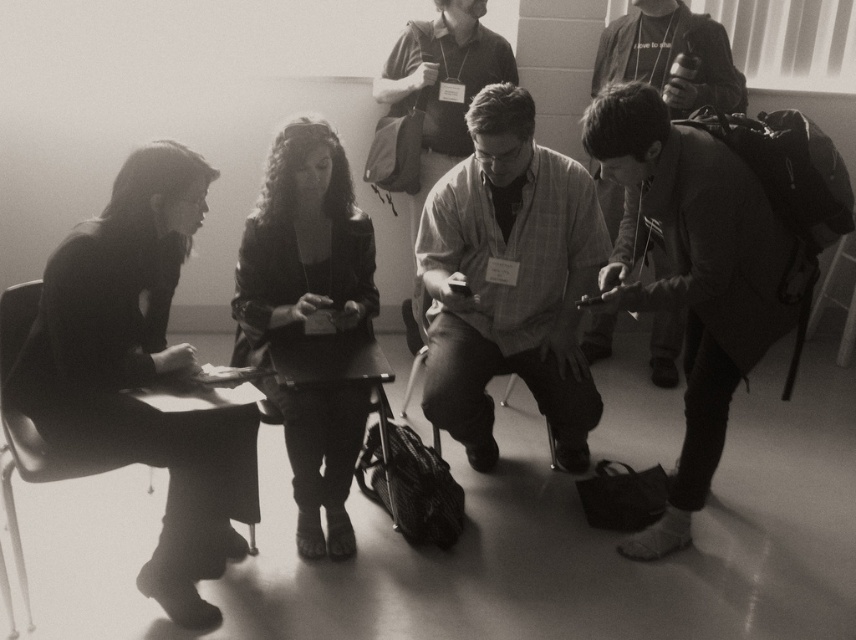
You are standing in the room and want to pick up the coarse fabric jacket at right to hand it to someone. Can you reach it without moving the metallic black chair at left?

The coarse fabric jacket at right is closer to the viewer than the metallic black chair at left, so you can reach it without moving the chair.

You are organizing a small event and need to place a decorative centerpiece on the table between the leather jacket at center and the camera. What is the minimum distance you should leave between them to ensure the centerpiece fits?

The leather jacket at center and the camera are 2.31 meters apart, so the minimum distance between them should be at least 2.31 meters to accommodate the centerpiece.

You are standing at the point labeled point [687,77]. You want to walk to the door that is 10.71 feet away from you. Is there enough space to walk straight to the door without any obstacles?

The distance between you and the door is 10.71 feet, so there is enough space to walk straight to the door without any obstacles as long as there are no objects blocking the path.